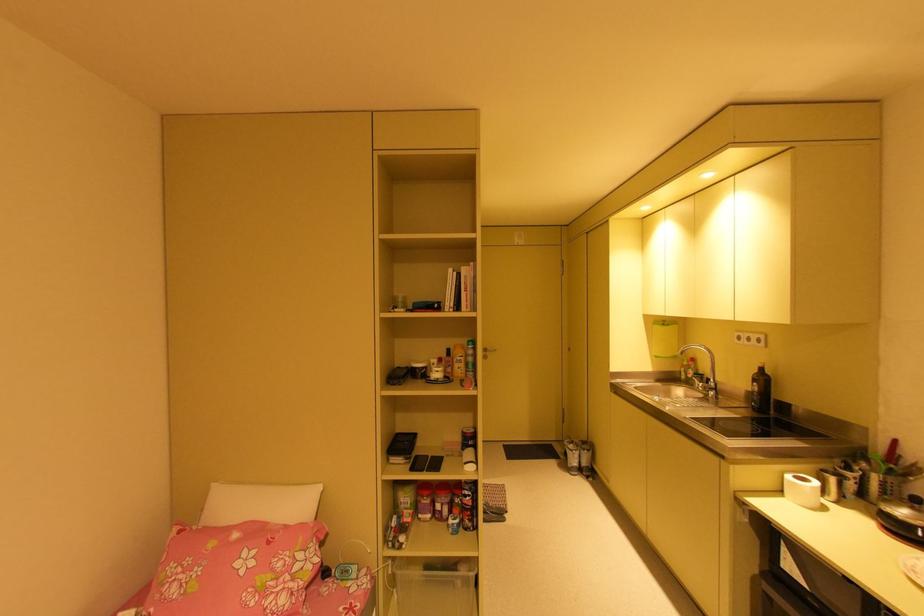
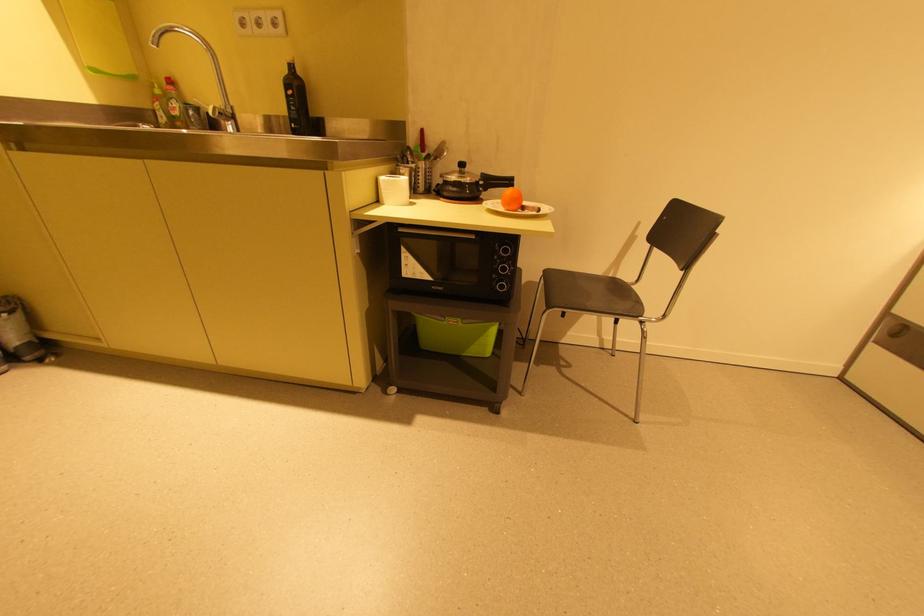
Locate, in the second image, the point that corresponds to point (752, 339) in the first image.

(263, 23)